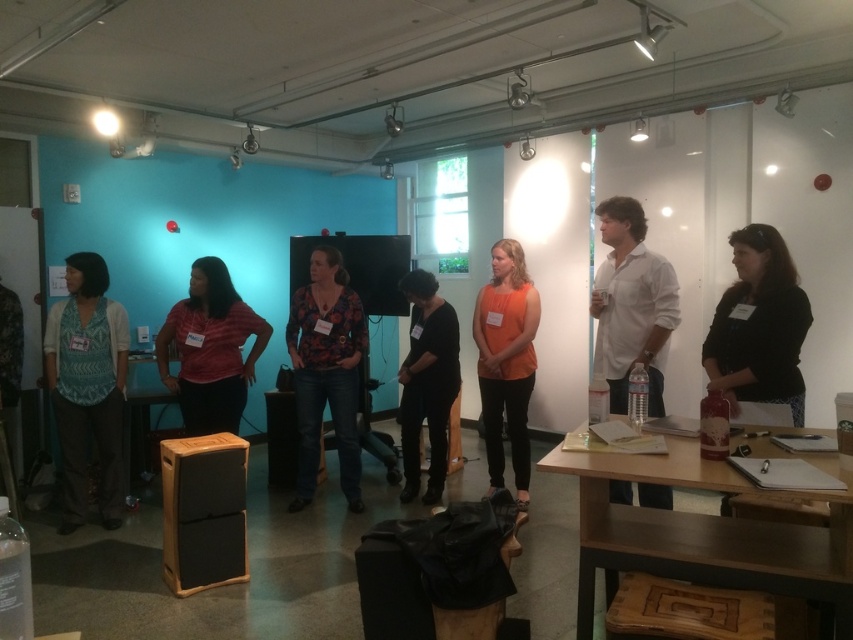
Question: Does wooden table at lower right appear over floral-patterned shirt at center?

Choices:
 (A) yes
 (B) no

Answer: (B)

Question: Which object is farther from the camera taking this photo?

Choices:
 (A) orange matte tank top at center
 (B) black matte dress at center
 (C) matte red shirt at center
 (D) wooden table at lower right

Answer: (B)

Question: Which object is positioned farthest from the floral-patterned shirt at center?

Choices:
 (A) wooden table at lower right
 (B) orange matte tank top at center
 (C) black matte dress at center

Answer: (A)

Question: Is orange matte tank top at center thinner than black matte dress at center?

Choices:
 (A) yes
 (B) no

Answer: (B)

Question: Which object is closer to the camera taking this photo?

Choices:
 (A) wooden table at lower right
 (B) orange matte tank top at center
 (C) black matte dress at center
 (D) floral-patterned shirt at center

Answer: (A)

Question: Is wooden table at lower right to the right of matte red shirt at center from the viewer's perspective?

Choices:
 (A) yes
 (B) no

Answer: (A)